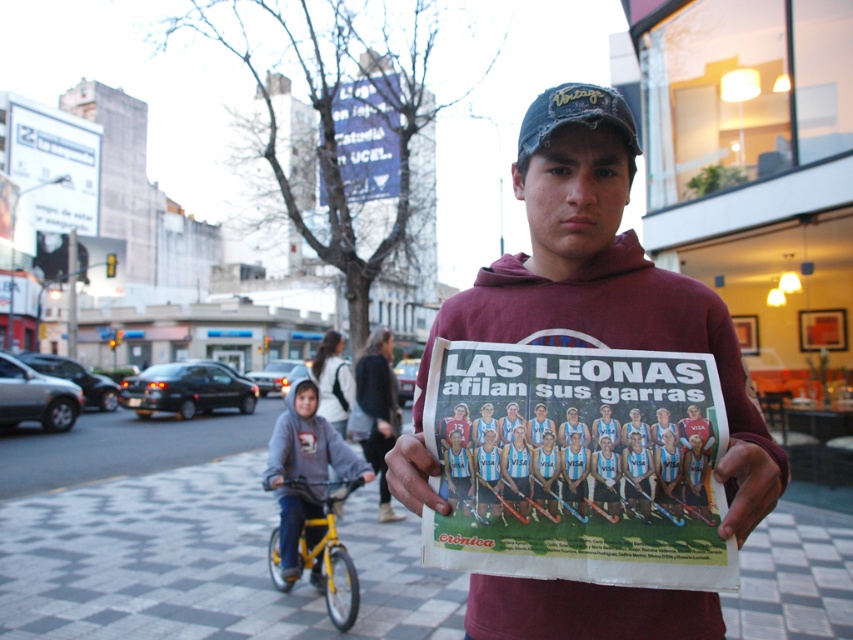
You are standing at the intersection near the traffic light. You want to reach the point marked at coordinates point (415, 412). If you walk straight ahead from your current position, will you reach that point within 2 meters?

The distance between point (415, 412) and the viewer is 1.75 meters, so yes, walking straight ahead will reach the point within 2 meters.